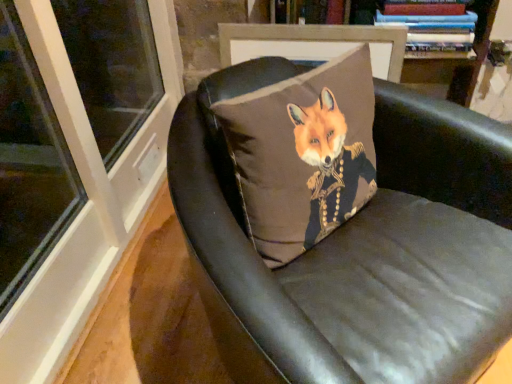
Question: Is matte brown pillow with fox design at center spatially inside leather cushion at center, or outside of it?

Choices:
 (A) outside
 (B) inside

Answer: (B)

Question: Relative to leather cushion at center, is matte brown pillow with fox design at center in front or behind?

Choices:
 (A) behind
 (B) front

Answer: (A)

Question: Which object is the farthest from the leather cushion at center?

Choices:
 (A) matte brown pillow with fox design at center
 (B) hardcover books at upper right

Answer: (B)

Question: Which is farther from the matte brown pillow with fox design at center?

Choices:
 (A) hardcover books at upper right
 (B) leather cushion at center

Answer: (A)